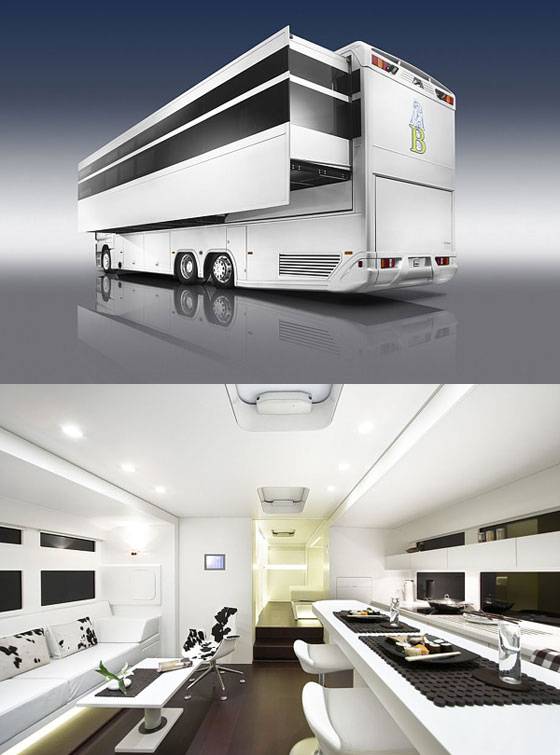
Locate an element on the screen. This screenshot has width=560, height=755. stove is located at coordinates (434, 608).